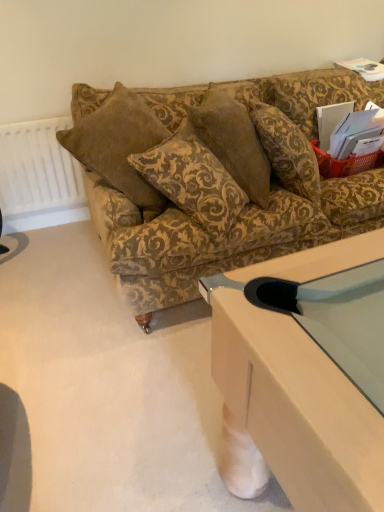
Where is `white plastic radiator at left`? The height and width of the screenshot is (512, 384). white plastic radiator at left is located at coordinates (38, 170).

Describe the element at coordinates (38, 170) in the screenshot. I see `white plastic radiator at left` at that location.

Image resolution: width=384 pixels, height=512 pixels. What are the coordinates of `white plastic radiator at left` in the screenshot? It's located at (38, 170).